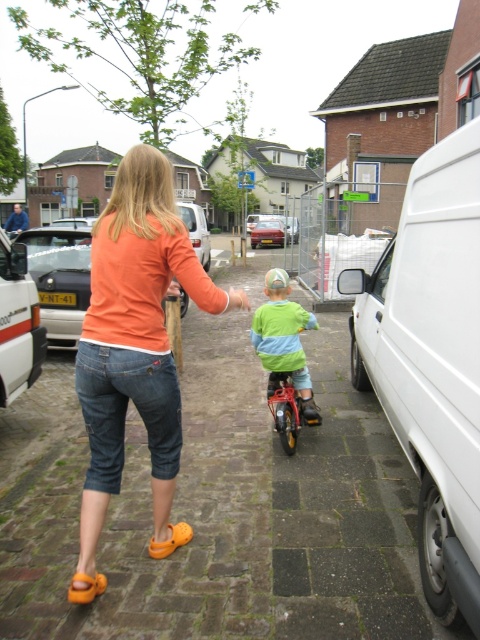
You are a delivery person trying to navigate through the residential area. You see a matte white van at center and a metallic red car at center. Which vehicle is blocking your path if you want to drive straight ahead?

The matte white van at center is blocking your path because it is in front of the metallic red car at center, meaning it is closer to your current position.

You are a delivery person standing at the camera position. You need to place a package that requires a 6.5 feet clearance area. Can you fit it between the white matte van at right and your current position?

The distance between the white matte van at right and the camera is 6.32 feet, which is slightly less than the required 6.5 feet clearance. Therefore, the package cannot be safely placed in that area.

Based on the photo, you are standing at the point marked by the coordinates point (472, 625) in the residential area scene. A friend is approaching you from the direction of the white van parked on the right side. How far will your friend have to walk to reach you?

The point marked by the coordinates point (472, 625) and the viewer are 1.96 meters apart, so your friend will have to walk approximately 1.96 meters to reach you.